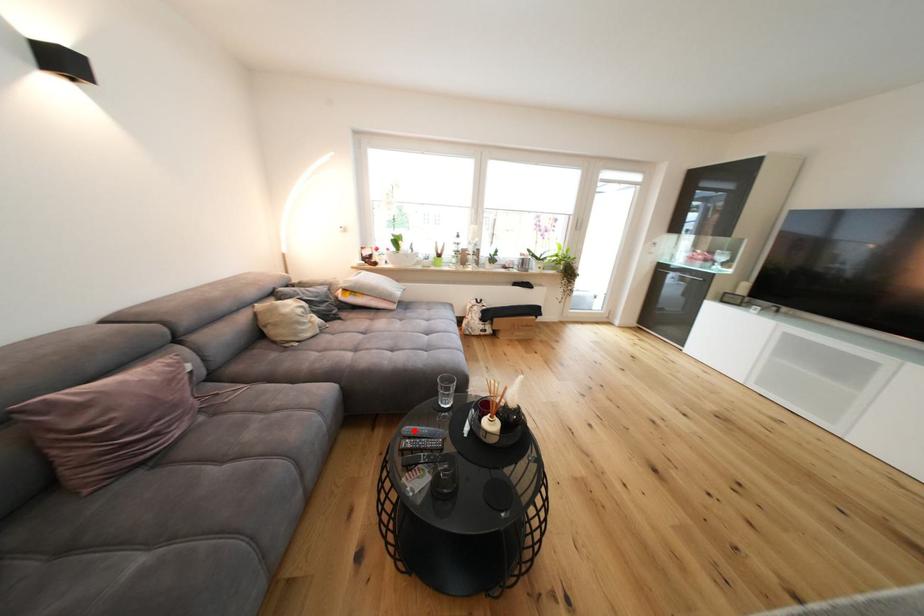
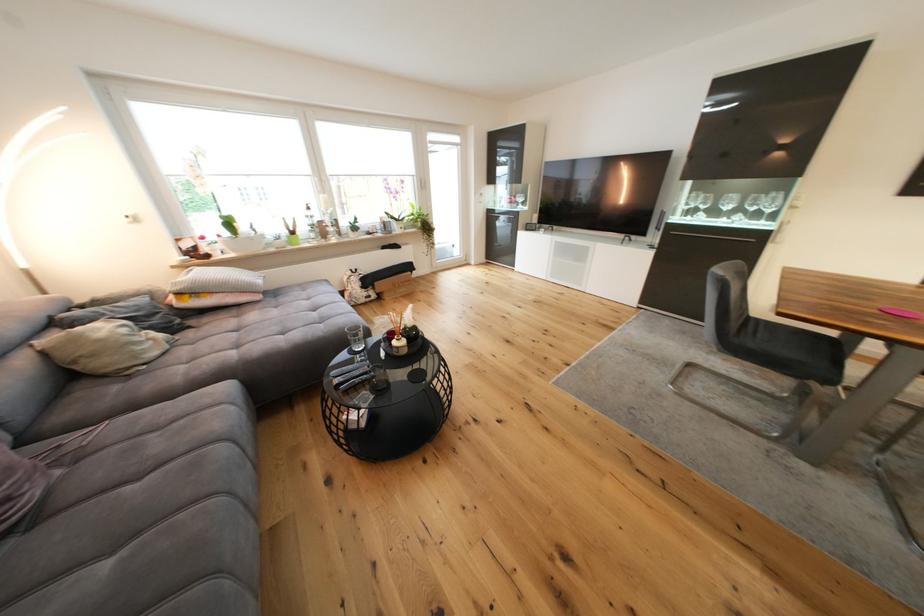
In the second image, find the point that corresponds to the highlighted location in the first image.

(341, 374)